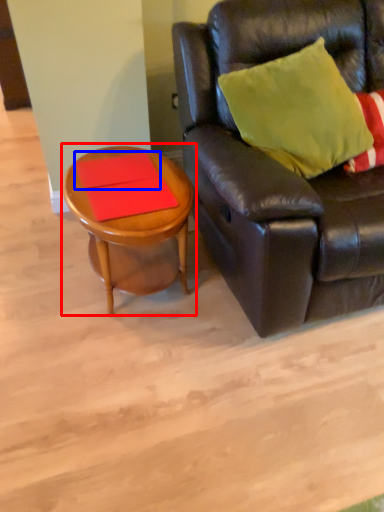
Question: Which object appears farthest to the camera in this image, coffee table (highlighted by a red box) or plank (highlighted by a blue box)?

Choices:
 (A) coffee table
 (B) plank

Answer: (B)